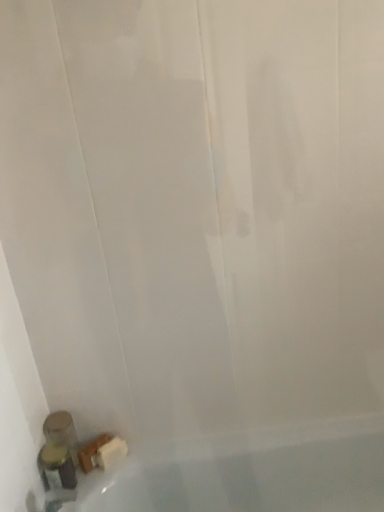
Question: Can you confirm if metallic silver soap dispenser at lower left, the 2th toiletry when ordered from back to front, is positioned to the right of translucent plastic soap at lower left, the second toiletry positioned from the front?

Choices:
 (A) yes
 (B) no

Answer: (A)

Question: Does metallic silver soap dispenser at lower left, the 2th toiletry when ordered from back to front, have a lesser height compared to translucent plastic soap at lower left, which is the 1th toiletry in back-to-front order?

Choices:
 (A) yes
 (B) no

Answer: (A)

Question: Does metallic silver soap dispenser at lower left, the 2th toiletry when ordered from back to front, appear on the left side of translucent plastic soap at lower left, which is the 1th toiletry in back-to-front order?

Choices:
 (A) no
 (B) yes

Answer: (A)

Question: Is metallic silver soap dispenser at lower left, placed as the first toiletry when sorted from front to back, thinner than translucent plastic soap at lower left, which is the 1th toiletry in back-to-front order?

Choices:
 (A) yes
 (B) no

Answer: (A)

Question: From the image's perspective, is metallic silver soap dispenser at lower left, the 2th toiletry when ordered from back to front, on translucent plastic soap at lower left, the second toiletry positioned from the front?

Choices:
 (A) yes
 (B) no

Answer: (B)

Question: Can we say metallic silver soap dispenser at lower left, placed as the first toiletry when sorted from front to back, lies outside translucent plastic soap at lower left, the second toiletry positioned from the front?

Choices:
 (A) no
 (B) yes

Answer: (B)

Question: From a real-world perspective, does translucent plastic soap at lower left, which is the 1th toiletry in back-to-front order, sit lower than metallic silver soap dispenser at lower left, the 2th toiletry when ordered from back to front?

Choices:
 (A) yes
 (B) no

Answer: (B)

Question: Is translucent plastic soap at lower left, the second toiletry positioned from the front, at the right side of metallic silver soap dispenser at lower left, the 2th toiletry when ordered from back to front?

Choices:
 (A) yes
 (B) no

Answer: (B)

Question: Can you confirm if translucent plastic soap at lower left, which is the 1th toiletry in back-to-front order, is positioned to the left of metallic silver soap dispenser at lower left, the 2th toiletry when ordered from back to front?

Choices:
 (A) yes
 (B) no

Answer: (A)

Question: From a real-world perspective, is translucent plastic soap at lower left, which is the 1th toiletry in back-to-front order, over metallic silver soap dispenser at lower left, placed as the first toiletry when sorted from front to back?

Choices:
 (A) no
 (B) yes

Answer: (B)

Question: Are translucent plastic soap at lower left, the second toiletry positioned from the front, and metallic silver soap dispenser at lower left, the 2th toiletry when ordered from back to front, far apart?

Choices:
 (A) yes
 (B) no

Answer: (B)

Question: Considering the relative sizes of translucent plastic soap at lower left, the second toiletry positioned from the front, and metallic silver soap dispenser at lower left, the 2th toiletry when ordered from back to front, in the image provided, is translucent plastic soap at lower left, the second toiletry positioned from the front, smaller than metallic silver soap dispenser at lower left, the 2th toiletry when ordered from back to front,?

Choices:
 (A) no
 (B) yes

Answer: (A)

Question: Is translucent plastic soap at lower left, which is the 1th toiletry in back-to-front order, wider or thinner than metallic silver soap dispenser at lower left, the 2th toiletry when ordered from back to front?

Choices:
 (A) wide
 (B) thin

Answer: (A)